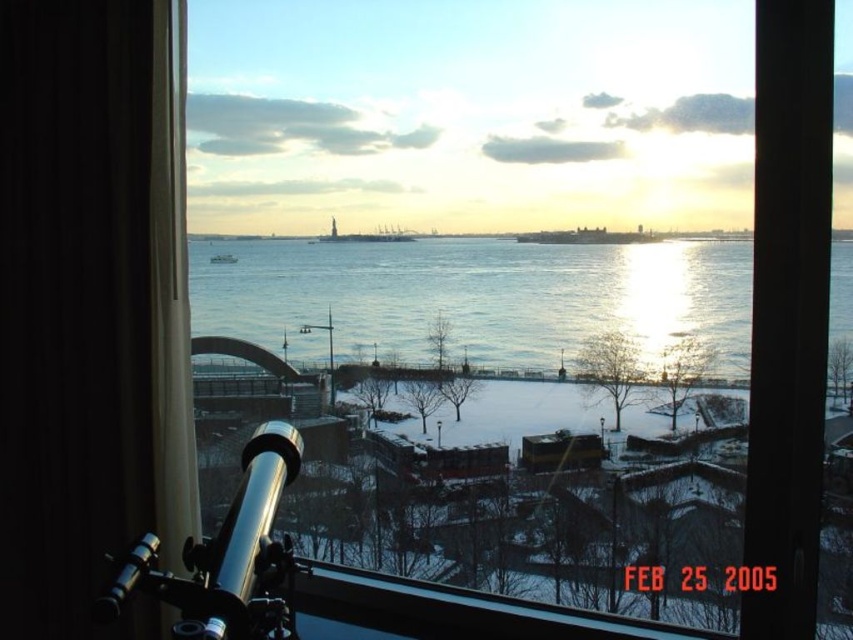
Based on the photo, you are an astronomer setting up equipment for a star observation event. You have a polished silver telescope at lower left and a white plastic boat at center. Which object is wider?

The polished silver telescope at lower left is wider than the white plastic boat at center.

You are an observer looking through the window at the winter scene. You see the clear blue water at center and the white plastic boat at center. Which object is positioned to the right of the other?

The clear blue water at center is to the right of the white plastic boat at center.